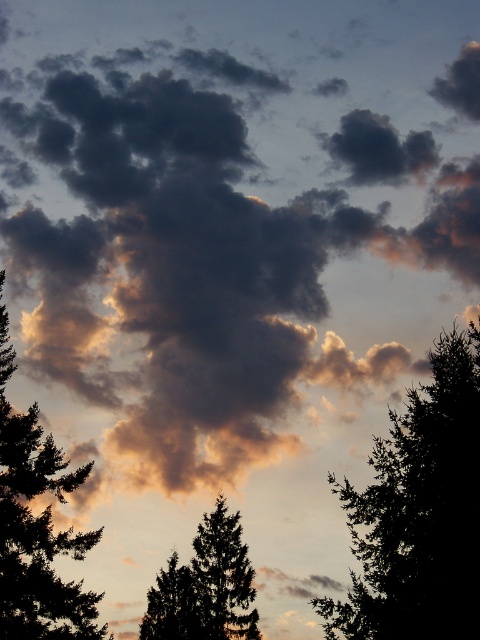
Between silhouette tree at upper center and green textured tree at center, which one is positioned lower?

green textured tree at center is lower down.

Can you confirm if silhouette tree at upper center is bigger than green textured tree at center?

No, silhouette tree at upper center is not bigger than green textured tree at center.

Identify the location of silhouette tree at upper center. This screenshot has width=480, height=640. (419, 513).

Does silhouette tree at upper center appear on the left side of silhouette evergreen tree at left?

No, silhouette tree at upper center is not to the left of silhouette evergreen tree at left.

Describe the element at coordinates (419, 513) in the screenshot. The height and width of the screenshot is (640, 480). I see `silhouette tree at upper center` at that location.

Does point (441, 392) come closer to viewer compared to point (7, 625)?

Yes, point (441, 392) is closer to viewer.

Identify the location of silhouette tree at upper center. (419, 513).

Does silhouette evergreen tree at left appear on the left side of green textured tree at center?

Indeed, silhouette evergreen tree at left is positioned on the left side of green textured tree at center.

Who is positioned more to the left, silhouette evergreen tree at left or green textured tree at center?

From the viewer's perspective, silhouette evergreen tree at left appears more on the left side.

Does point (61, 588) lie behind point (236, 614)?

No, (61, 588) is closer to viewer.

This screenshot has width=480, height=640. I want to click on silhouette evergreen tree at left, so click(x=36, y=529).